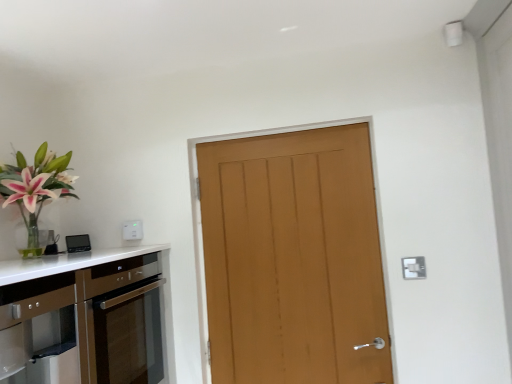
Question: In which direction should I rotate to look at white plastic electric outlet at upper center, the 2th electric outlet viewed from the front?

Choices:
 (A) left
 (B) right

Answer: (A)

Question: Is white plastic electric outlet at upper center, the 2th electric outlet positioned from the right, positioned far away from wooden door at center?

Choices:
 (A) yes
 (B) no

Answer: (B)

Question: Does white plastic electric outlet at upper center, which appears as the first electric outlet when viewed from the top, have a smaller size compared to wooden door at center?

Choices:
 (A) yes
 (B) no

Answer: (A)

Question: Is white plastic electric outlet at upper center, which appears as the first electric outlet when viewed from the top, thinner than wooden door at center?

Choices:
 (A) no
 (B) yes

Answer: (B)

Question: Is wooden door at center located within white plastic electric outlet at upper center, the 2th electric outlet viewed from the front?

Choices:
 (A) yes
 (B) no

Answer: (B)

Question: Can you confirm if white plastic electric outlet at upper center, which appears as the first electric outlet when viewed from the top, is positioned to the right of wooden door at center?

Choices:
 (A) yes
 (B) no

Answer: (B)

Question: From a real-world perspective, is white plastic electric outlet at upper center, the 2th electric outlet viewed from the front, over wooden door at center?

Choices:
 (A) no
 (B) yes

Answer: (B)

Question: Is satin brown cabinetry at lower left thinner than wooden door at center?

Choices:
 (A) no
 (B) yes

Answer: (A)

Question: Does satin brown cabinetry at lower left turn towards wooden door at center?

Choices:
 (A) yes
 (B) no

Answer: (A)

Question: Is satin brown cabinetry at lower left positioned beyond the bounds of wooden door at center?

Choices:
 (A) no
 (B) yes

Answer: (B)

Question: Is satin brown cabinetry at lower left positioned far away from wooden door at center?

Choices:
 (A) yes
 (B) no

Answer: (B)

Question: Does satin brown cabinetry at lower left have a lesser height compared to wooden door at center?

Choices:
 (A) no
 (B) yes

Answer: (B)

Question: Is satin brown cabinetry at lower left at the left side of wooden door at center?

Choices:
 (A) no
 (B) yes

Answer: (B)

Question: Considering the relative sizes of white plastic electric outlet at upper center, the second electric outlet positioned from the bottom, and satin brown cabinetry at lower left in the image provided, is white plastic electric outlet at upper center, the second electric outlet positioned from the bottom, shorter than satin brown cabinetry at lower left?

Choices:
 (A) yes
 (B) no

Answer: (A)